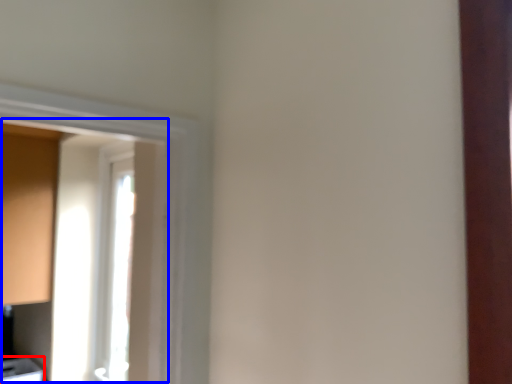
Question: Which of the following is the farthest to the observer, cabinetry (highlighted by a red box) or window screen (highlighted by a blue box)?

Choices:
 (A) cabinetry
 (B) window screen

Answer: (A)